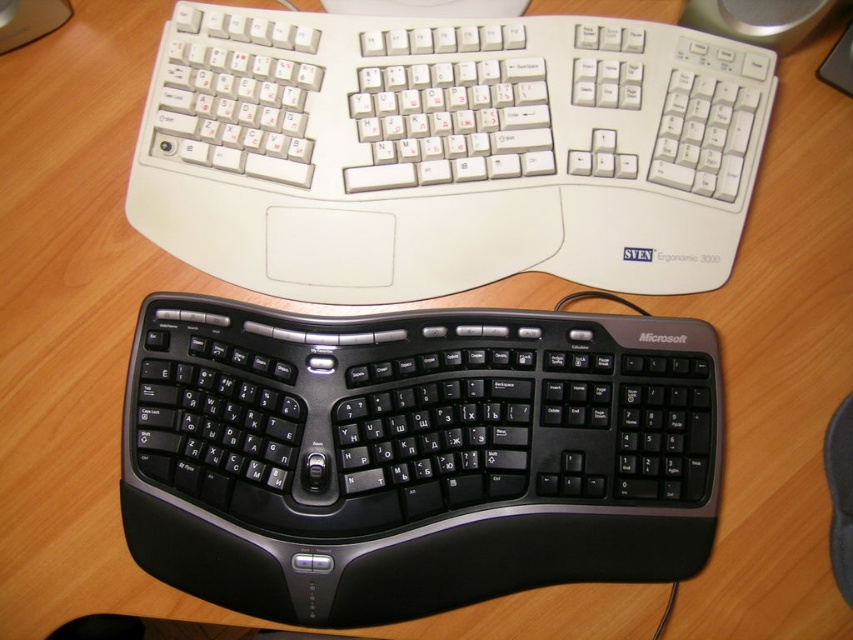
Which is more to the left, black plastic keyboard at center or white plastic keyboard at upper center?

black plastic keyboard at center

Is black plastic keyboard at center closer to camera compared to white plastic keyboard at upper center?

That is True.

Does point (309, 452) lie in front of point (654, 278)?

Yes.

Where is `black plastic keyboard at center`? The image size is (853, 640). black plastic keyboard at center is located at coordinates (415, 456).